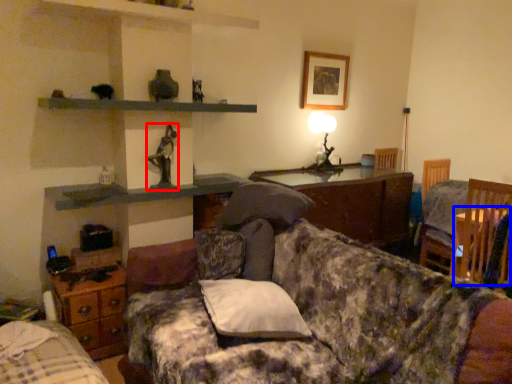
Question: Which of the following is the farthest to the observer, person (highlighted by a red box) or table (highlighted by a blue box)?

Choices:
 (A) person
 (B) table

Answer: (A)